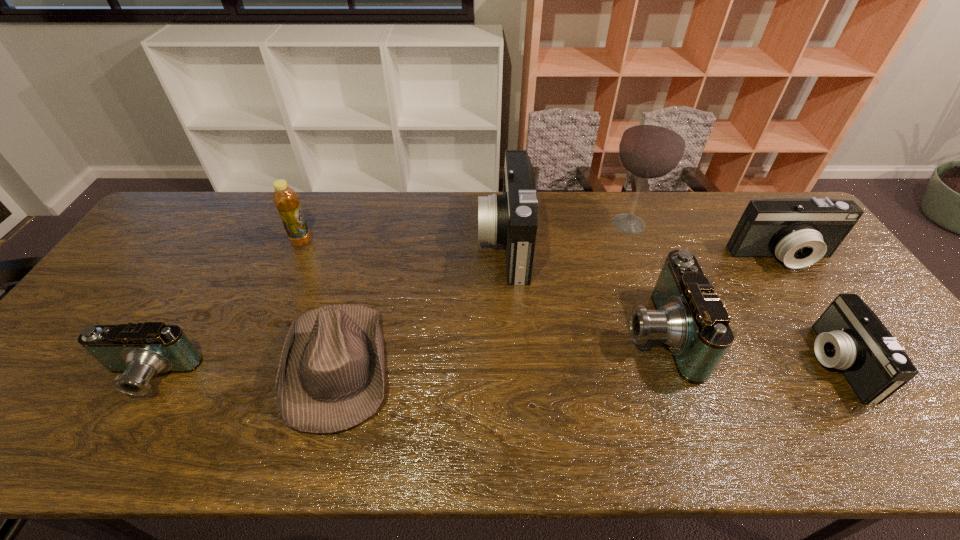
The height and width of the screenshot is (540, 960). In order to click on the left blue camcorder in this screenshot , I will do `click(140, 351)`.

Where is `fedora`? This screenshot has width=960, height=540. fedora is located at coordinates (330, 378).

Locate an element on the screen. The width and height of the screenshot is (960, 540). free space located 0.050m on the front of the alcohol is located at coordinates [x=639, y=253].

The width and height of the screenshot is (960, 540). Find the location of `vacant position located 0.370m on the lens of the fifth object from right to left`. vacant position located 0.370m on the lens of the fifth object from right to left is located at coordinates (361, 242).

The width and height of the screenshot is (960, 540). Find the location of `free spot located 0.110m on the lens of the fifth object from right to left`. free spot located 0.110m on the lens of the fifth object from right to left is located at coordinates (444, 242).

Find the location of a particular element. The width and height of the screenshot is (960, 540). free spot located on the lens of the fifth object from right to left is located at coordinates tap(365, 242).

Where is `vacant point located 0.070m on the front of the bottle`? The image size is (960, 540). vacant point located 0.070m on the front of the bottle is located at coordinates (292, 265).

The width and height of the screenshot is (960, 540). I want to click on vacant space situated 0.370m on the lens of the second biggest black camcorder, so 870,384.

Locate an element on the screen. The width and height of the screenshot is (960, 540). vacant space situated 0.060m on the front-facing side of the third camcorder from right to left is located at coordinates (600, 333).

Locate an element on the screen. Image resolution: width=960 pixels, height=540 pixels. free space located on the front-facing side of the third camcorder from right to left is located at coordinates (539, 333).